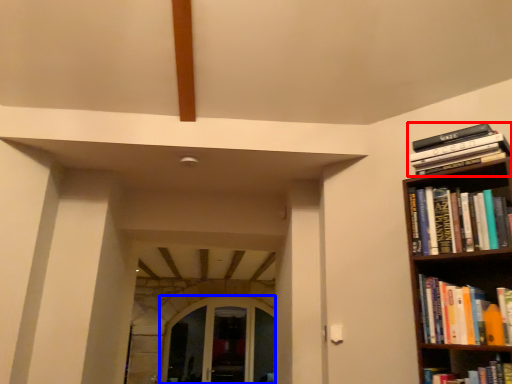
Question: Which object appears farthest to the camera in this image, book (highlighted by a red box) or glass door (highlighted by a blue box)?

Choices:
 (A) book
 (B) glass door

Answer: (B)